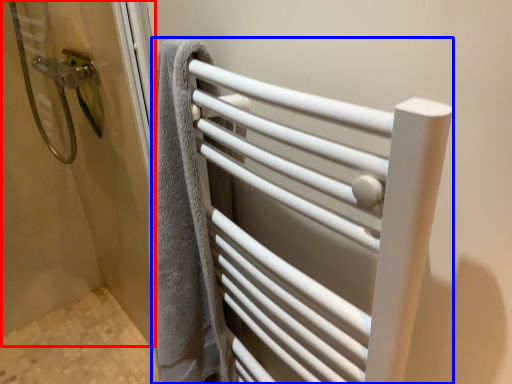
Question: Which object is further to the camera taking this photo, screen door (highlighted by a red box) or towel rack (highlighted by a blue box)?

Choices:
 (A) screen door
 (B) towel rack

Answer: (A)